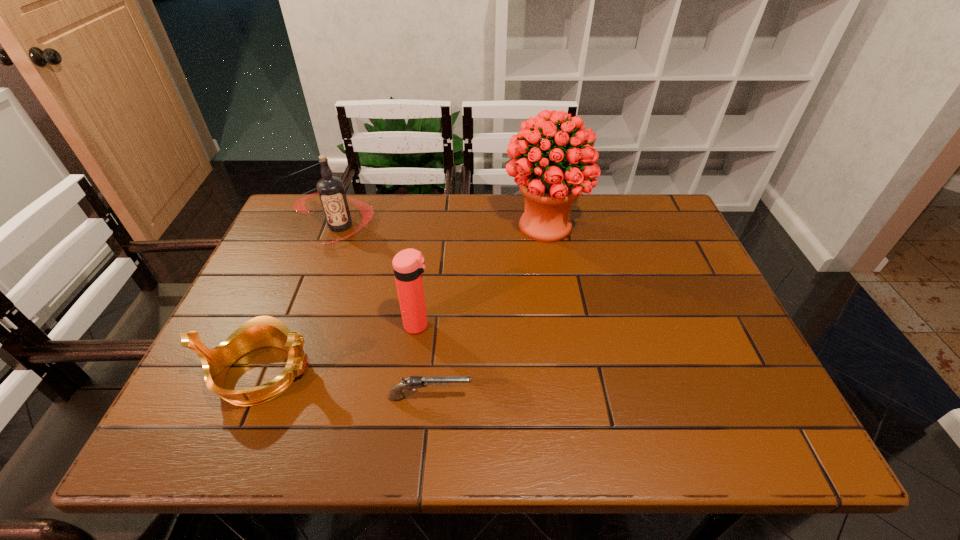
This screenshot has width=960, height=540. I want to click on the tallest object, so click(549, 188).

The image size is (960, 540). I want to click on bouquet, so click(549, 188).

This screenshot has height=540, width=960. What are the coordinates of `root beer` in the screenshot? It's located at (331, 191).

I want to click on the third nearest object, so click(x=408, y=265).

This screenshot has width=960, height=540. Identify the location of tiara. (263, 331).

Where is `the shortest object`? The height and width of the screenshot is (540, 960). the shortest object is located at coordinates point(395,394).

This screenshot has width=960, height=540. I want to click on vacant region located 0.180m on the front of the bouquet, so click(x=558, y=299).

I want to click on blank area located 0.320m on the label of the root beer, so click(x=299, y=338).

Locate an element on the screen. The height and width of the screenshot is (540, 960). vacant area situated 0.170m on the left of the third nearest object is located at coordinates (331, 325).

The image size is (960, 540). I want to click on blank space located at the front emblem of the fourth tallest object, so click(x=374, y=373).